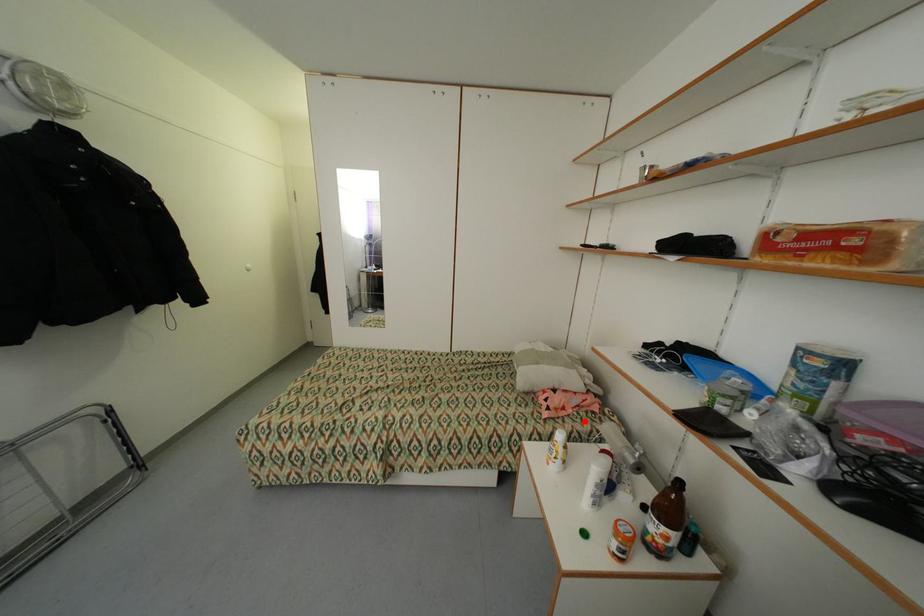
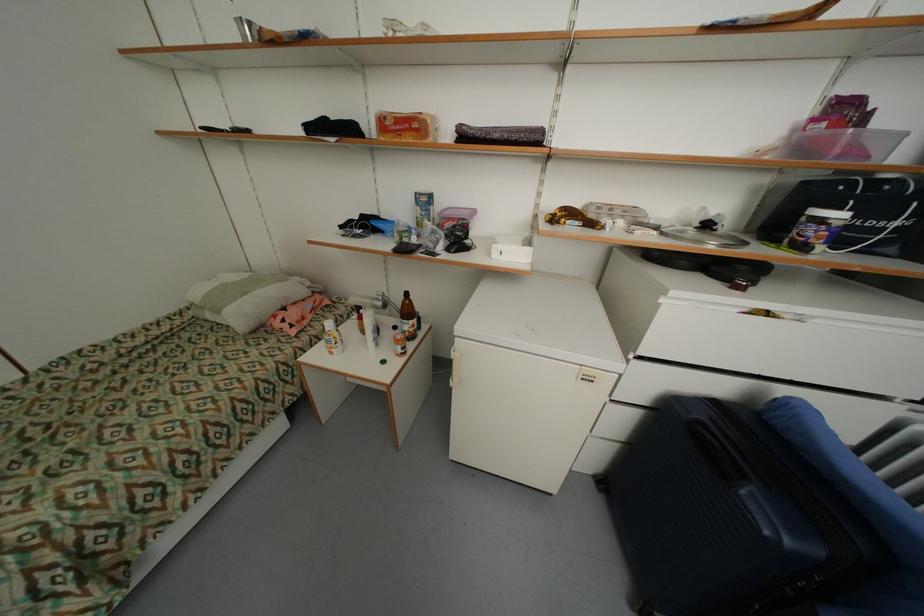
Find the pixel in the second image that matches the highlighted location in the first image.

(327, 320)